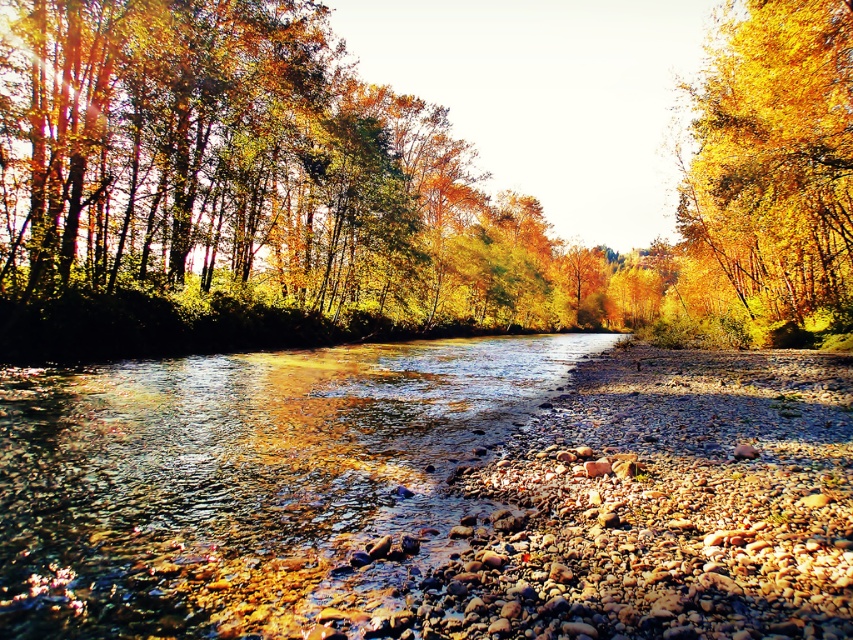
Is golden textured tree at center thinner than clear water at center?

No.

Does golden textured tree at center appear on the left side of clear water at center?

No, golden textured tree at center is not to the left of clear water at center.

Where is `golden textured tree at center`? The image size is (853, 640). golden textured tree at center is located at coordinates (398, 176).

Image resolution: width=853 pixels, height=640 pixels. Identify the location of clear water at center. (245, 477).

Does clear water at center appear under golden leafy tree at upper right?

Yes, clear water at center is below golden leafy tree at upper right.

Is point (41, 426) closer to camera compared to point (843, 269)?

That is True.

In order to click on clear water at center in this screenshot , I will do `click(245, 477)`.

Which is behind, point (125, 44) or point (708, 70)?

The point (708, 70) is behind.

Is point (90, 257) more distant than point (819, 262)?

No, it is not.

Locate an element on the screen. This screenshot has height=640, width=853. golden textured tree at center is located at coordinates (398, 176).